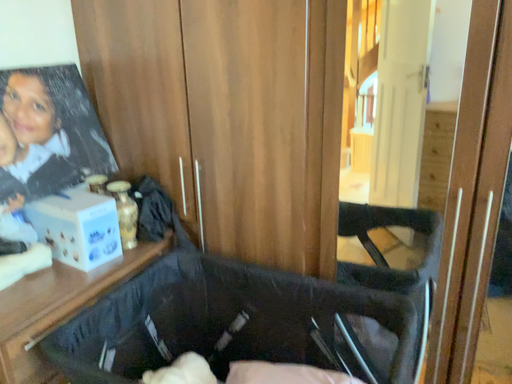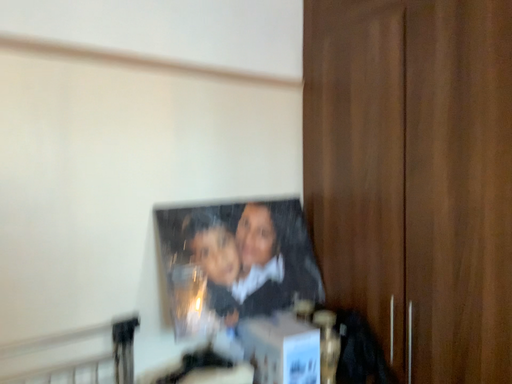
Question: Which way did the camera rotate in the video?

Choices:
 (A) rotated downward
 (B) rotated upward

Answer: (B)